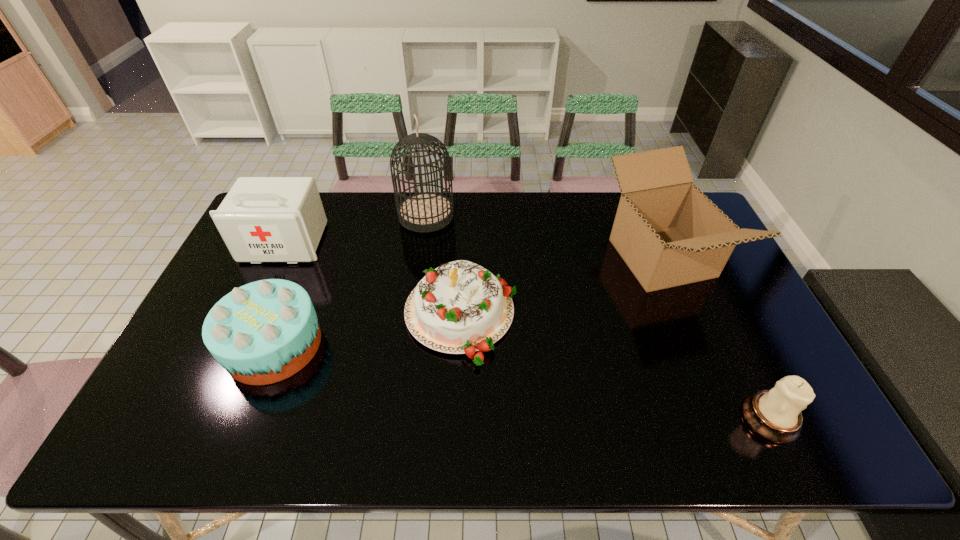
In order to click on the tallest object in this screenshot , I will do `click(427, 211)`.

Identify the location of box. The image size is (960, 540). (669, 233).

The image size is (960, 540). What are the coordinates of `the first-aid kit` in the screenshot? It's located at (262, 219).

This screenshot has width=960, height=540. What are the coordinates of `the right cake` in the screenshot? It's located at (460, 307).

Where is `the left cake`? The width and height of the screenshot is (960, 540). the left cake is located at coordinates (263, 332).

Image resolution: width=960 pixels, height=540 pixels. I want to click on the nearest object, so click(775, 415).

Locate an element on the screen. This screenshot has height=540, width=960. free space located 0.250m on the left of the birdcage is located at coordinates (328, 215).

The width and height of the screenshot is (960, 540). I want to click on blank space located on the left of the box, so click(483, 258).

The width and height of the screenshot is (960, 540). Find the location of `vacant position located on the front-facing side of the first-aid kit`. vacant position located on the front-facing side of the first-aid kit is located at coordinates (255, 306).

At what (x,y) coordinates should I click in order to perform the action: click on free space located on the right of the right cake. Please return your answer as a coordinate pair (x, y). Looking at the image, I should click on (536, 316).